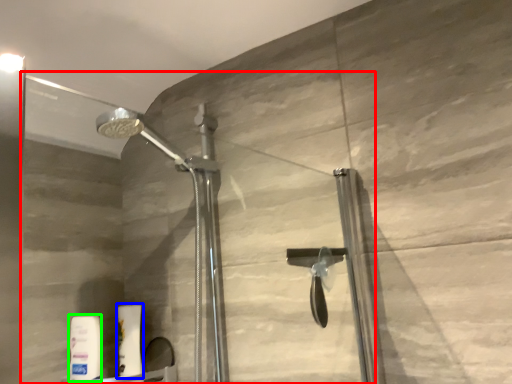
Question: Which is nearer to the glass door (highlighted by a red box)? toiletry (highlighted by a blue box) or toiletry (highlighted by a green box).

Choices:
 (A) toiletry
 (B) toiletry

Answer: (A)